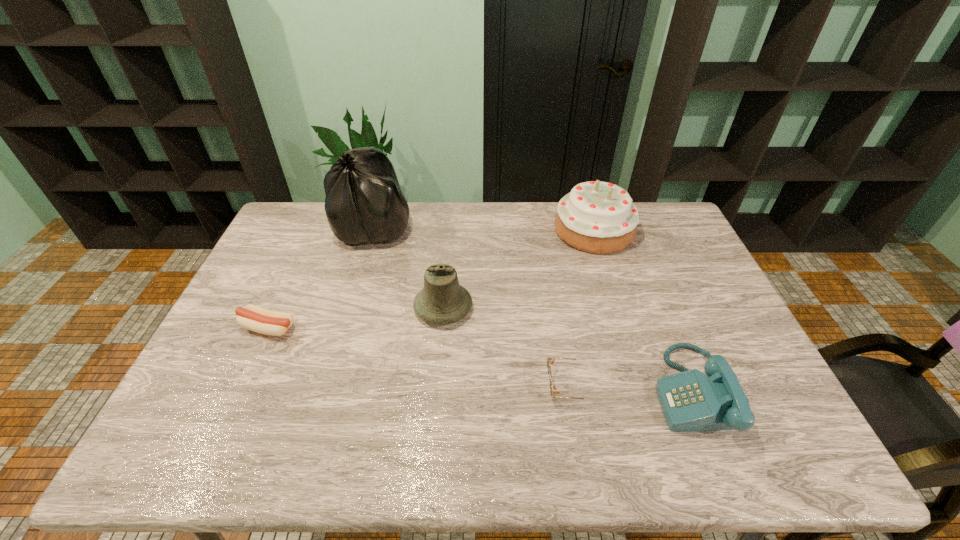
Where is `free point located 0.160m on the dial of the telephone`? free point located 0.160m on the dial of the telephone is located at coordinates (590, 390).

Locate an element on the screen. The height and width of the screenshot is (540, 960). vacant area located on the dial of the telephone is located at coordinates (507, 390).

Find the location of a particular element. free region located 0.150m on the dial of the telephone is located at coordinates (594, 390).

The height and width of the screenshot is (540, 960). Find the location of `free space located on the front lenses of the sunglasses`. free space located on the front lenses of the sunglasses is located at coordinates (442, 385).

Locate an element on the screen. vacant space located 0.210m on the front lenses of the sunglasses is located at coordinates (466, 385).

The width and height of the screenshot is (960, 540). What are the coordinates of `vacant space located on the front lenses of the sunglasses` in the screenshot? It's located at (466, 385).

Identify the location of free point located on the right of the sausage. The width and height of the screenshot is (960, 540). (332, 328).

At what (x,y) coordinates should I click in order to perform the action: click on plastic bag that is at the far edge. Please return your answer as a coordinate pair (x, y). Looking at the image, I should click on (364, 203).

The image size is (960, 540). I want to click on cake at the far edge, so click(596, 217).

I want to click on object situated at the near edge, so (690, 400).